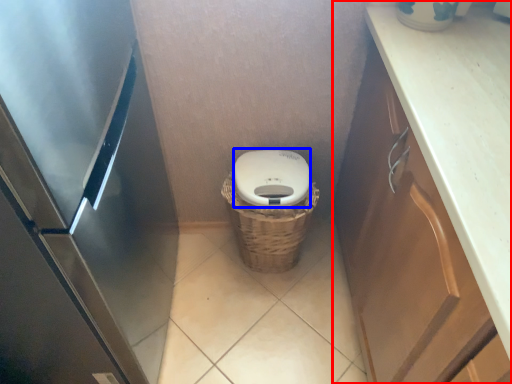
Question: Which of the following is the closest to the observer, cabinetry (highlighted by a red box) or lid (highlighted by a blue box)?

Choices:
 (A) cabinetry
 (B) lid

Answer: (A)